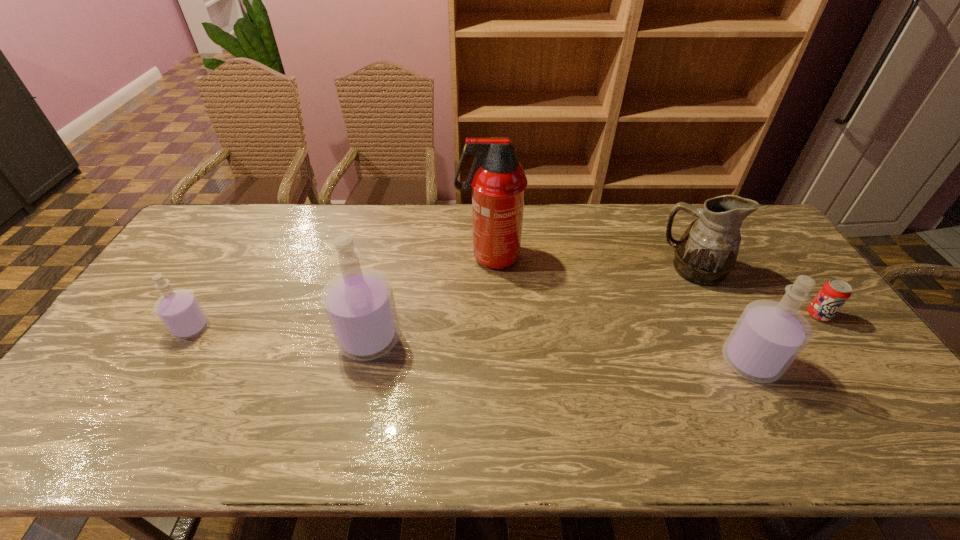
Identify the location of vacant space in between the second tallest perfume and the second object from left to right. (560, 350).

Locate an element on the screen. This screenshot has height=540, width=960. free space between the pitcher and the fire extinguisher is located at coordinates (592, 262).

Locate an element on the screen. The height and width of the screenshot is (540, 960). vacant area between the second perfume from left to right and the rightmost perfume is located at coordinates (560, 350).

Find the location of a particular element. This screenshot has height=540, width=960. vacant space that's between the pitcher and the third object from left to right is located at coordinates 592,262.

In order to click on empty space between the pitcher and the soda can in this screenshot , I will do `click(756, 292)`.

The width and height of the screenshot is (960, 540). What are the coordinates of `vacant space that's between the second shortest object and the shortest object` in the screenshot? It's located at (505, 321).

Identify which object is the third nearest to the fire extinguisher. Please provide its 2D coordinates. Your answer should be formatted as a tuple, i.e. [(x, y)], where the tuple contains the x and y coordinates of a point satisfying the conditions above.

[(769, 335)]

Identify which object is located as the third nearest to the soda can. Please provide its 2D coordinates. Your answer should be formatted as a tuple, i.e. [(x, y)], where the tuple contains the x and y coordinates of a point satisfying the conditions above.

[(497, 180)]

Identify the location of perfume identified as the second closest to the shortest perfume. (769, 335).

Locate which perfume is the closest to the fifth object from right to left. Please provide its 2D coordinates. Your answer should be formatted as a tuple, i.e. [(x, y)], where the tuple contains the x and y coordinates of a point satisfying the conditions above.

[(179, 310)]